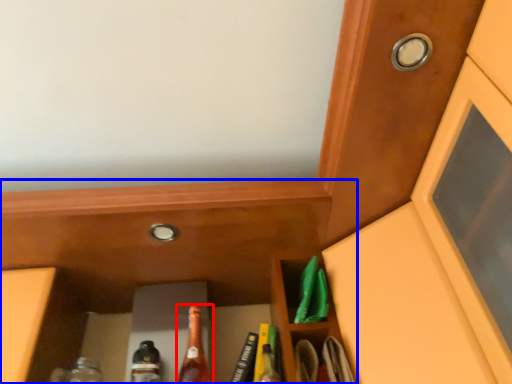
Question: Which object appears farthest to the camera in this image, beer bottle (highlighted by a red box) or cabinetry (highlighted by a blue box)?

Choices:
 (A) beer bottle
 (B) cabinetry

Answer: (A)